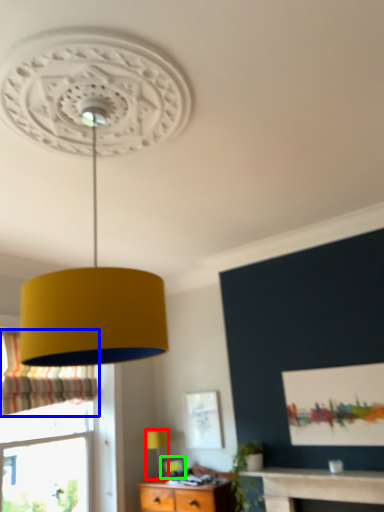
Question: Which object is the closest to the table lamp (highlighted by a red box)? Choose among these: curtain (highlighted by a blue box) or picture frame (highlighted by a green box).

Choices:
 (A) curtain
 (B) picture frame

Answer: (B)